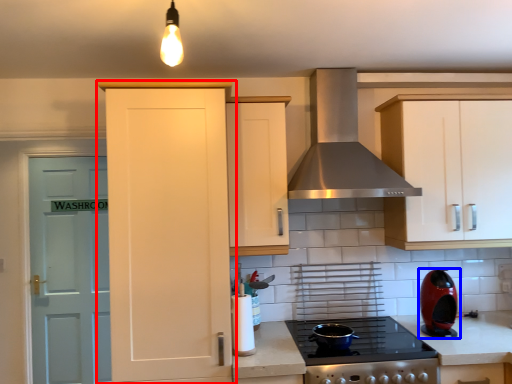
Question: Which object is closer to the camera taking this photo, cabinetry (highlighted by a red box) or kitchen appliance (highlighted by a blue box)?

Choices:
 (A) cabinetry
 (B) kitchen appliance

Answer: (A)